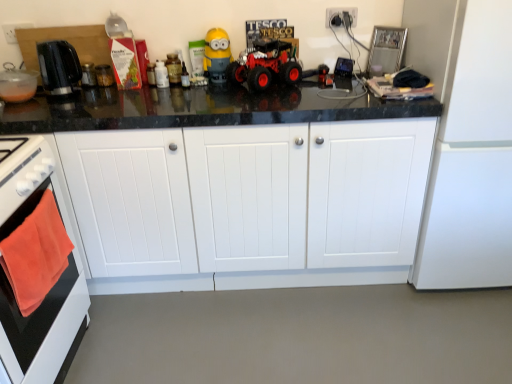
Find the location of a particular element. vacant area that lies in front of rubberized red toy car at center is located at coordinates (292, 100).